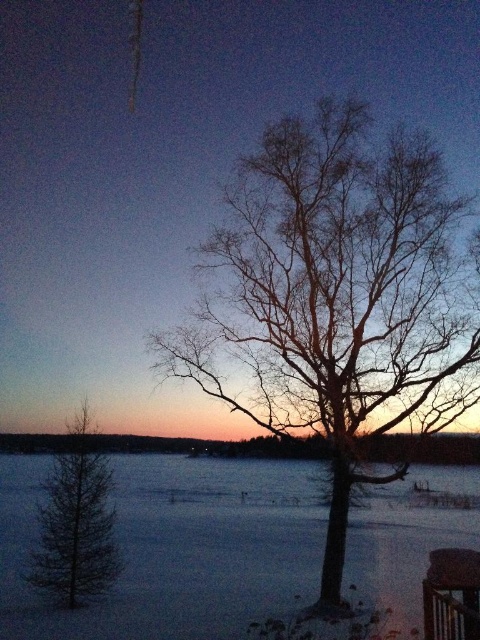
You are an astronomer observing the night sky. You notice a star at point (336, 296). Is there any object in the image that might block your view of this star?

The bare branches at center located at point (336, 296) would block your view of the star at that point.

You are an artist sketching this winter scene. You want to draw the bare branches at center and the dark green coniferous tree at lower left. Which object should you draw first to maintain proper layering?

You should draw the dark green coniferous tree at lower left first because the bare branches at center is in front of it, so the tree should be placed behind the branches in the sketch.

You are an outdoor photographer who wants to capture a wide shot of the snowy white water at lower left and dark green coniferous tree at lower left in the winter scene. Based on their sizes, which object will occupy more space in your photo?

The snowy white water at lower left is larger in size than the dark green coniferous tree at lower left, so it will occupy more space in the photo.